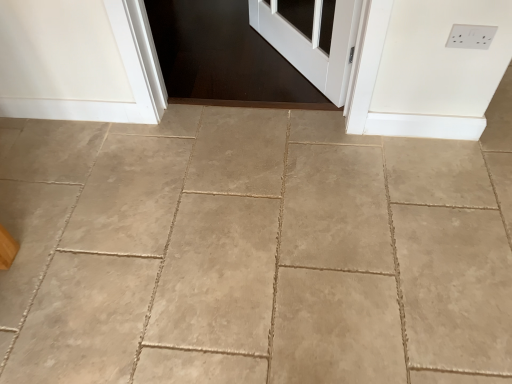
The width and height of the screenshot is (512, 384). Describe the element at coordinates (249, 253) in the screenshot. I see `beige tile floor at center` at that location.

I want to click on beige tile floor at center, so click(249, 253).

You are a GUI agent. You are given a task and a screenshot of the screen. Output one action in this format:
    pyautogui.click(x=<x>, y=<y>)
    Task: Click on the white plastic electric outlet at upper right
    The height and width of the screenshot is (384, 512).
    Given the screenshot: What is the action you would take?
    pyautogui.click(x=471, y=36)

What do you see at coordinates (471, 36) in the screenshot?
I see `white plastic electric outlet at upper right` at bounding box center [471, 36].

In order to click on beige tile floor at center in this screenshot , I will do `click(249, 253)`.

Between beige tile floor at center and white plastic electric outlet at upper right, which one appears on the right side from the viewer's perspective?

Positioned to the right is white plastic electric outlet at upper right.

Does beige tile floor at center come behind white plastic electric outlet at upper right?

No, it is not.

Does point (214, 110) come in front of point (487, 39)?

No, (214, 110) is behind (487, 39).

From the image's perspective, does beige tile floor at center appear lower than white plastic electric outlet at upper right?

Yes, from the image's perspective, beige tile floor at center is beneath white plastic electric outlet at upper right.

Looking at this image, from a real-world perspective, does beige tile floor at center sit lower than white plastic electric outlet at upper right?

Correct, in the physical world, beige tile floor at center is lower than white plastic electric outlet at upper right.

In the scene shown: Is beige tile floor at center wider than white plastic electric outlet at upper right?

Yes, beige tile floor at center is wider than white plastic electric outlet at upper right.

Is beige tile floor at center taller or shorter than white plastic electric outlet at upper right?

beige tile floor at center is shorter than white plastic electric outlet at upper right.

Is beige tile floor at center bigger or smaller than white plastic electric outlet at upper right?

Considering their sizes, beige tile floor at center takes up more space than white plastic electric outlet at upper right.

Is white plastic electric outlet at upper right located within beige tile floor at center?

No.

Are beige tile floor at center and white plastic electric outlet at upper right far apart?

Yes, beige tile floor at center is far from white plastic electric outlet at upper right.

Is beige tile floor at center aimed at white plastic electric outlet at upper right?

No.

How far apart are beige tile floor at center and white plastic electric outlet at upper right?

A distance of 3.31 feet exists between beige tile floor at center and white plastic electric outlet at upper right.

Identify the location of electric outlet that appears on the right of beige tile floor at center. Image resolution: width=512 pixels, height=384 pixels. (471, 36).

Would you say white plastic electric outlet at upper right is to the left or to the right of beige tile floor at center in the picture?

Based on their positions, white plastic electric outlet at upper right is located to the right of beige tile floor at center.

Based on the photo, considering their positions, is white plastic electric outlet at upper right located in front of or behind beige tile floor at center?

Visually, white plastic electric outlet at upper right is located behind beige tile floor at center.

Does point (486, 27) lie behind point (47, 299)?

No, it is in front of (47, 299).

From the image's perspective, would you say white plastic electric outlet at upper right is positioned over beige tile floor at center?

Indeed, from the image's perspective, white plastic electric outlet at upper right is shown above beige tile floor at center.

From a real-world perspective, between white plastic electric outlet at upper right and beige tile floor at center, who is vertically higher?

In real-world perspective, white plastic electric outlet at upper right is above.

Which object is thinner, white plastic electric outlet at upper right or beige tile floor at center?

Thinner between the two is white plastic electric outlet at upper right.

In terms of height, does white plastic electric outlet at upper right look taller or shorter compared to beige tile floor at center?

white plastic electric outlet at upper right is taller than beige tile floor at center.

Considering the relative sizes of white plastic electric outlet at upper right and beige tile floor at center in the image provided, is white plastic electric outlet at upper right smaller than beige tile floor at center?

Yes.

Is white plastic electric outlet at upper right not inside beige tile floor at center?

Yes, white plastic electric outlet at upper right is outside of beige tile floor at center.

Are white plastic electric outlet at upper right and beige tile floor at center far apart?

Yes.

Is white plastic electric outlet at upper right facing towards beige tile floor at center?

No, white plastic electric outlet at upper right does not turn towards beige tile floor at center.

Can you tell me how much white plastic electric outlet at upper right and beige tile floor at center differ in facing direction?

The angular difference between white plastic electric outlet at upper right and beige tile floor at center is 91.3 degrees.

Locate an element on the screen. concrete below the white plastic electric outlet at upper right (from the image's perspective) is located at coordinates (249, 253).

The image size is (512, 384). I want to click on electric outlet lying on the right of beige tile floor at center, so click(x=471, y=36).

In order to click on concrete below the white plastic electric outlet at upper right (from the image's perspective) in this screenshot , I will do `click(249, 253)`.